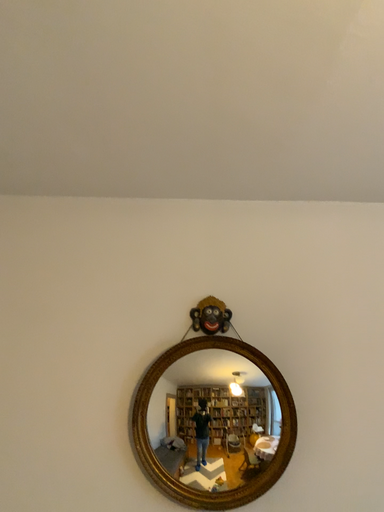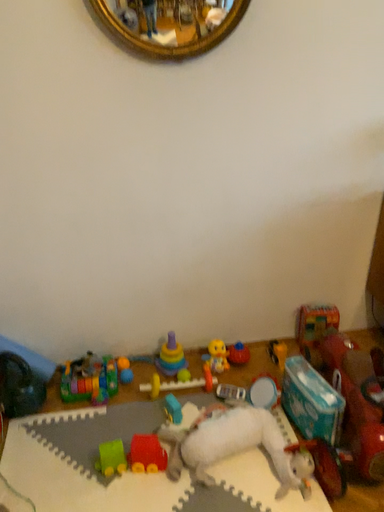
Question: How did the camera likely rotate when shooting the video?

Choices:
 (A) rotated right
 (B) rotated left

Answer: (A)